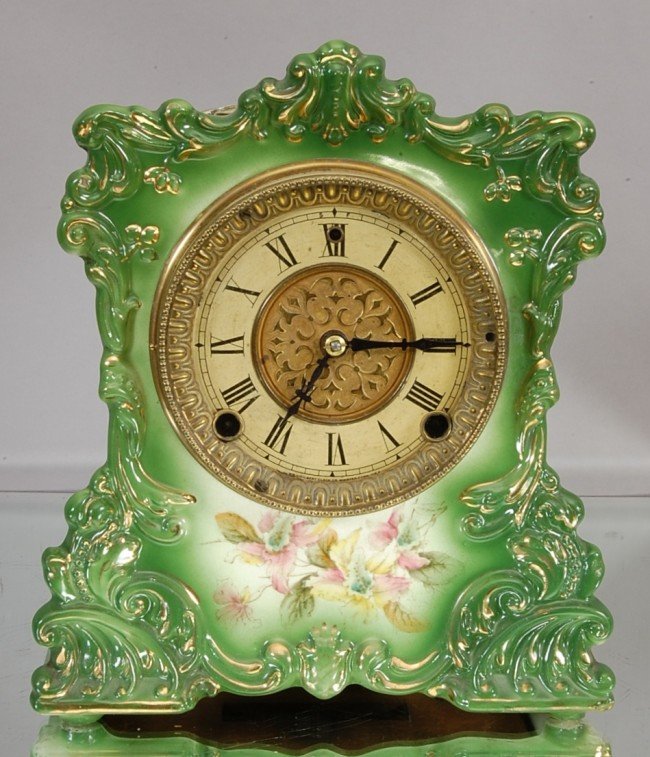
At what (x,y) coordinates should I click in order to perform the action: click on mirrow. Please return your answer as a coordinate pair (x, y). Looking at the image, I should click on (629, 530), (21, 519).